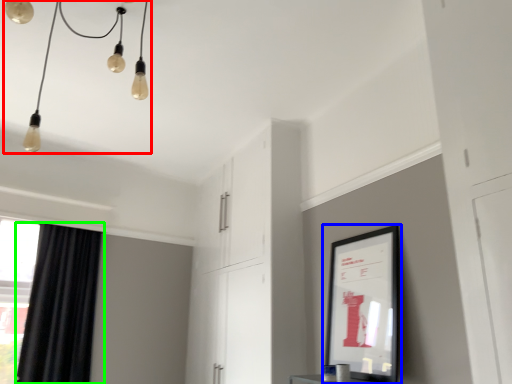
Question: Considering the real-world distances, which object is farthest from light fixture (highlighted by a red box)? picture frame (highlighted by a blue box) or curtain (highlighted by a green box)?

Choices:
 (A) picture frame
 (B) curtain

Answer: (A)